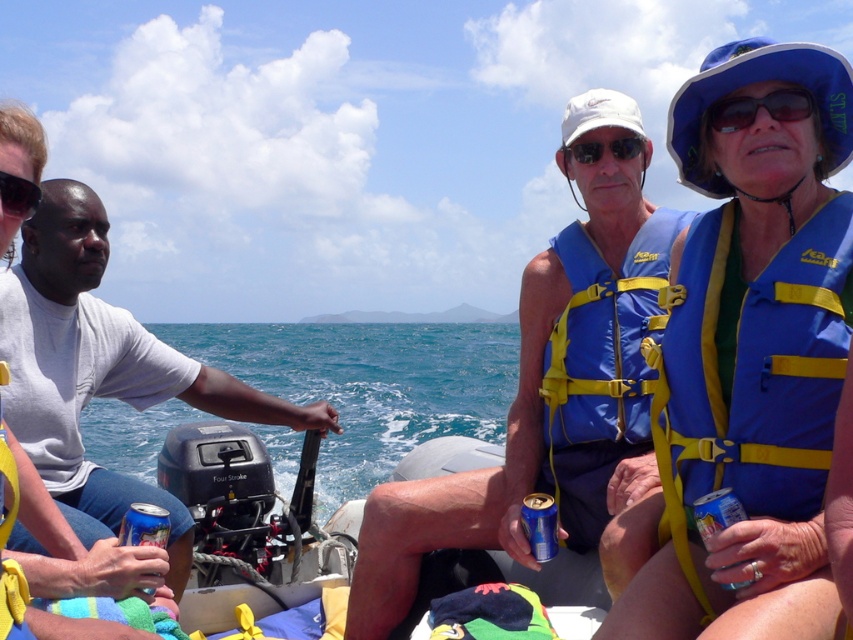
You are a safety inspector on the boat and need to ensure all safety gear is properly stored. According to the image, where is the blue life vest at center right in relation to the sunglassestransparent at upper right?

The blue life vest at center right is below the sunglassestransparent at upper right, so it is positioned lower than the sunglasses in the image.

You are a safety inspector checking the boat for compliance. You notice the blue life vest at center right and the sunglassestransparent at upper right. Which item is bigger in size?

The blue life vest at center right is larger in size than the sunglassestransparent at upper right.